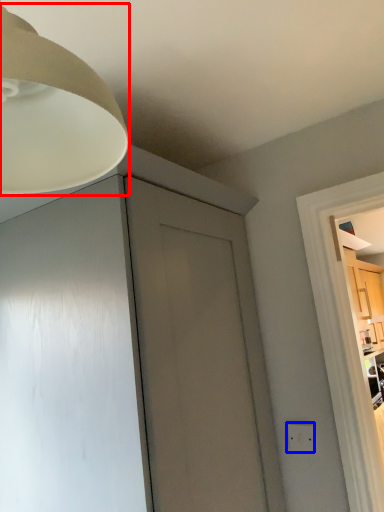
Question: Which of the following is the farthest to the observer, lamp (highlighted by a red box) or electric outlet (highlighted by a blue box)?

Choices:
 (A) lamp
 (B) electric outlet

Answer: (B)